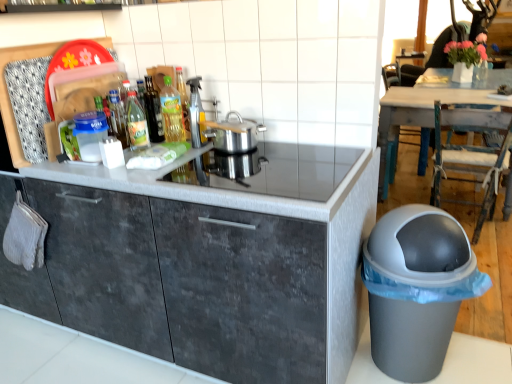
I want to click on free space in front of translucent glass bottle at center, the 2th bottle from the left, so click(123, 168).